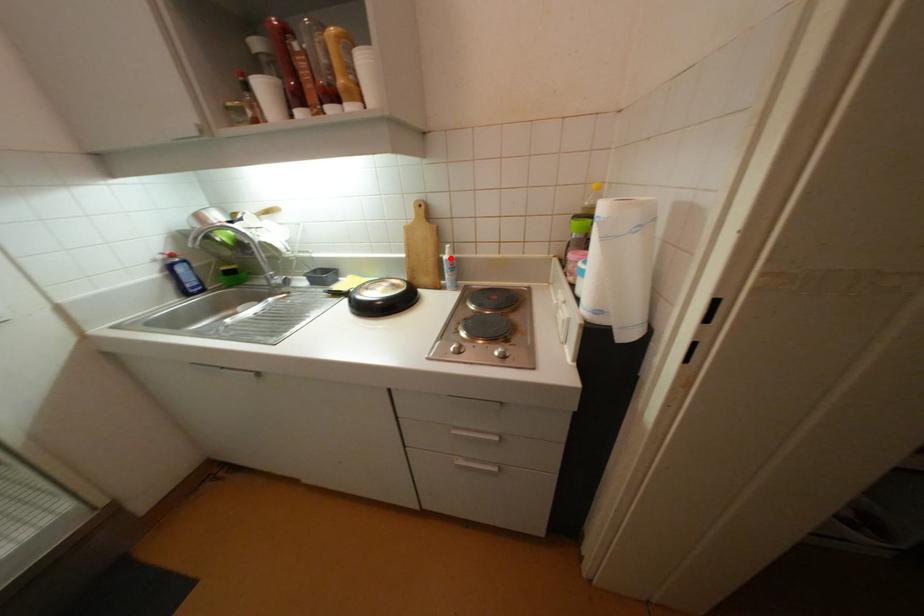
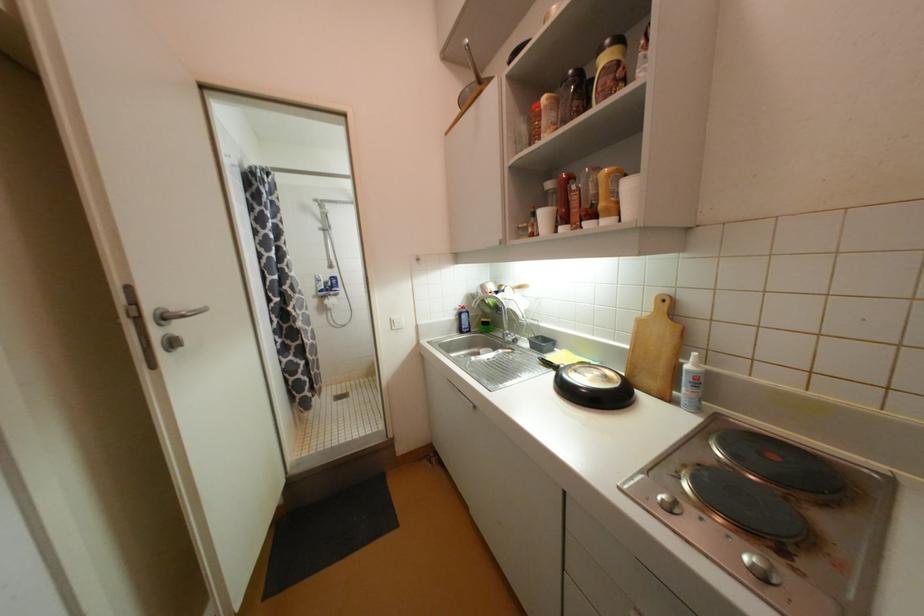
Locate, in the second image, the point that corresponds to the highlighted location in the first image.

(693, 368)